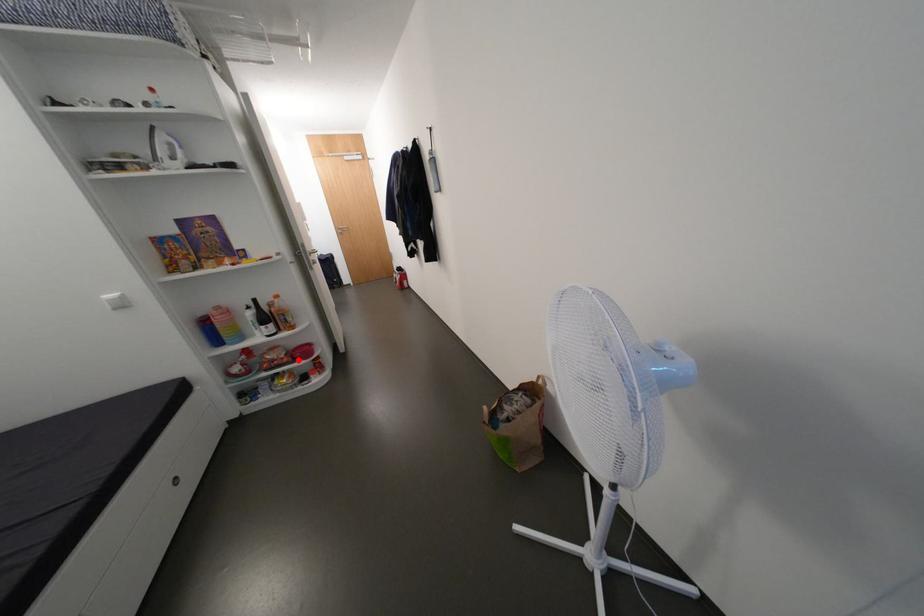
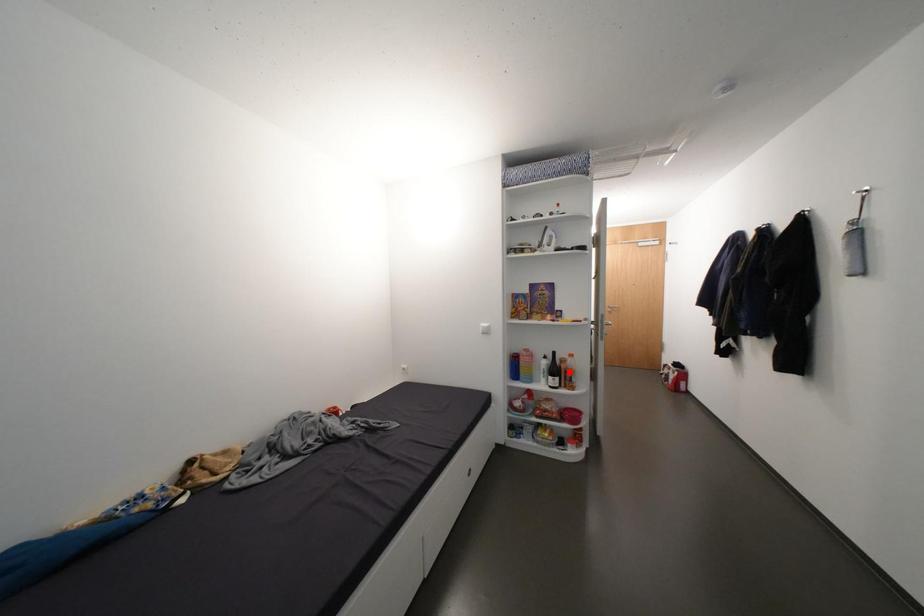
I am providing you with two images of the same scene from different viewpoints. A red point is marked on the first image and another point is marked on the second image. Is the marked point in image1 the same physical position as the marked point in image2?

No